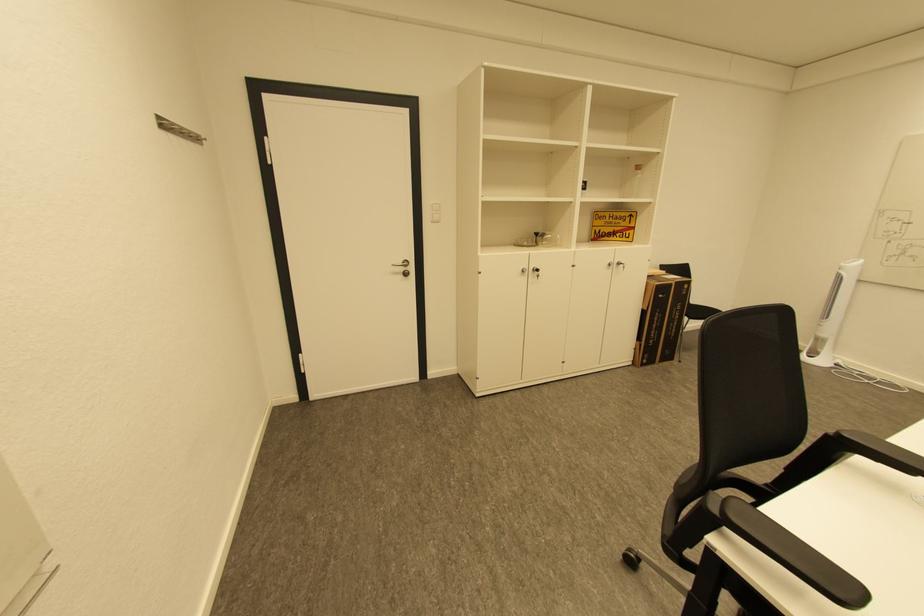
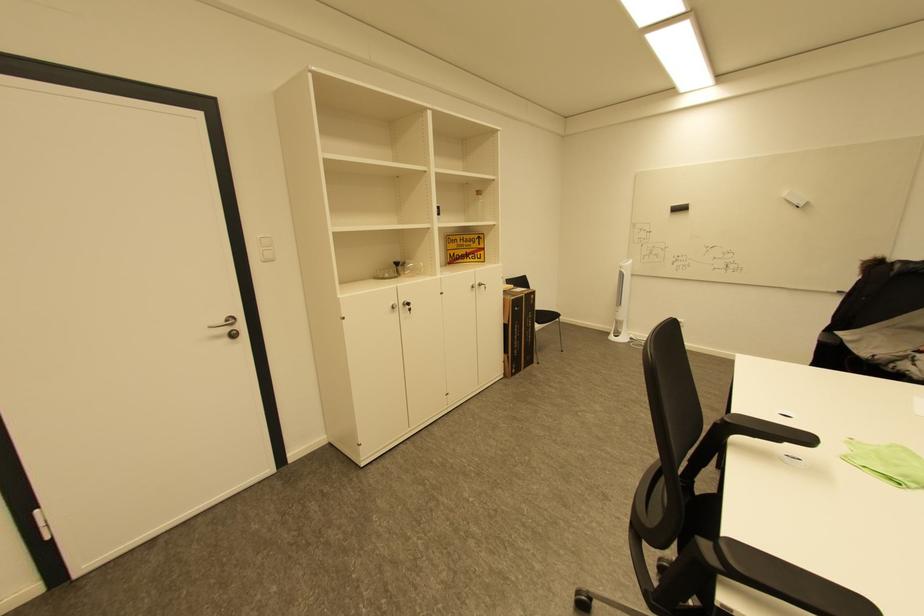
In a continuous first-person perspective shot, in which direction is the camera moving?

The movement direction of the cameraman is left, forward.